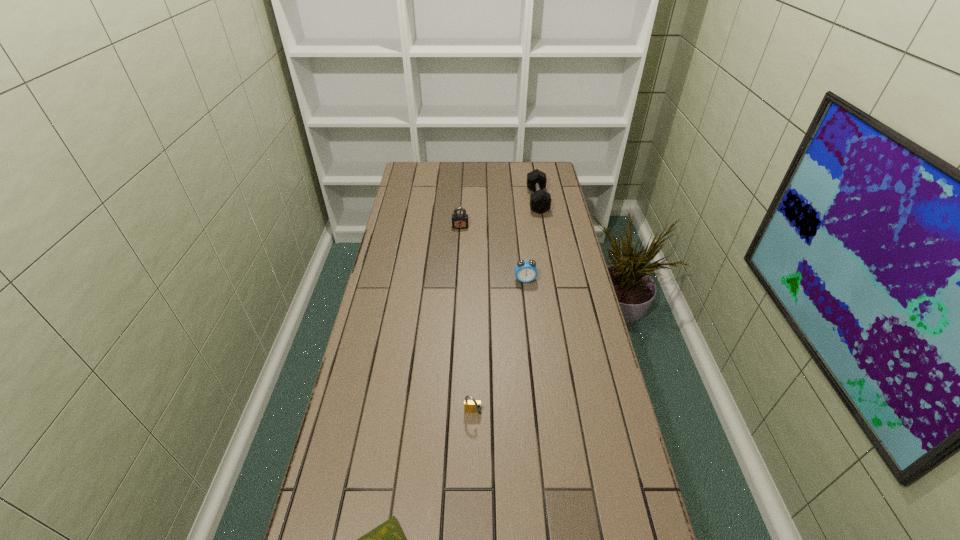
At what (x,y) coordinates should I click in order to perform the action: click on vacant space situated 0.110m on the face of the second object from right to left. Please return your answer as a coordinate pair (x, y). The height and width of the screenshot is (540, 960). Looking at the image, I should click on (528, 305).

You are a GUI agent. You are given a task and a screenshot of the screen. Output one action in this format:
    pyautogui.click(x=<x>, y=<y>)
    Task: Click on the vacant point located 0.260m on the side with the combination dials of the second nearest object
    The width and height of the screenshot is (960, 540).
    Given the screenshot: What is the action you would take?
    pyautogui.click(x=471, y=522)

At what (x,y) coordinates should I click in order to perform the action: click on object located at the right edge. Please return your answer as a coordinate pair (x, y). The height and width of the screenshot is (540, 960). Looking at the image, I should click on (540, 201).

You are a GUI agent. You are given a task and a screenshot of the screen. Output one action in this format:
    pyautogui.click(x=<x>, y=<y>)
    Task: Click on the vacant area at the left edge of the desktop
    
    Given the screenshot: What is the action you would take?
    pyautogui.click(x=362, y=346)

I want to click on free space at the right edge of the desktop, so click(577, 268).

This screenshot has width=960, height=540. In the image, there is a desktop. Identify the location of vacant space at the far left corner. (431, 176).

The height and width of the screenshot is (540, 960). In order to click on vacant space at the far right corner of the desktop in this screenshot , I will do `click(548, 180)`.

Image resolution: width=960 pixels, height=540 pixels. I want to click on free space between the nearer padlock and the left padlock, so click(467, 320).

You are a GUI agent. You are given a task and a screenshot of the screen. Output one action in this format:
    pyautogui.click(x=<x>, y=<y>)
    Task: Click on the vacant region between the taller padlock and the third nearest object
    The height and width of the screenshot is (540, 960).
    Given the screenshot: What is the action you would take?
    pyautogui.click(x=492, y=253)

Find the location of a particular element. vacant space that's between the taller padlock and the dumbbell is located at coordinates (499, 213).